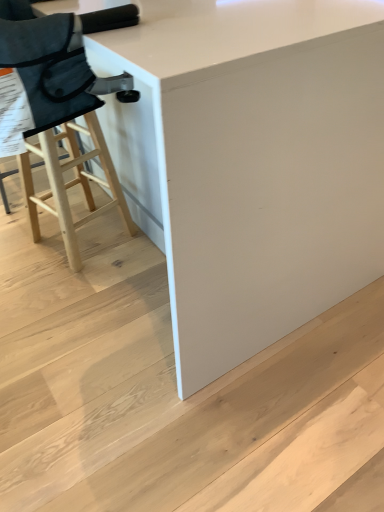
Question: Does white glossy table at center come in front of white matte stair at lower center?

Choices:
 (A) yes
 (B) no

Answer: (A)

Question: Is the depth of white glossy table at center greater than that of white matte stair at lower center?

Choices:
 (A) no
 (B) yes

Answer: (A)

Question: Can you confirm if white glossy table at center is taller than white matte stair at lower center?

Choices:
 (A) no
 (B) yes

Answer: (B)

Question: Is white glossy table at center far from white matte stair at lower center?

Choices:
 (A) yes
 (B) no

Answer: (B)

Question: Is white glossy table at center positioned with its back to white matte stair at lower center?

Choices:
 (A) no
 (B) yes

Answer: (A)

Question: Is point (97, 480) closer or farther from the camera than point (64, 50)?

Choices:
 (A) closer
 (B) farther

Answer: (B)

Question: Considering the positions of white matte stair at lower center and natural wood stool at left in the image, is white matte stair at lower center bigger or smaller than natural wood stool at left?

Choices:
 (A) big
 (B) small

Answer: (A)

Question: Considering the positions of white matte stair at lower center and natural wood stool at left in the image, is white matte stair at lower center wider or thinner than natural wood stool at left?

Choices:
 (A) wide
 (B) thin

Answer: (A)

Question: Which is correct: white matte stair at lower center is inside natural wood stool at left, or outside of it?

Choices:
 (A) inside
 (B) outside

Answer: (B)

Question: Based on their sizes in the image, would you say white glossy table at center is bigger or smaller than natural wood stool at left?

Choices:
 (A) small
 (B) big

Answer: (B)

Question: Is white glossy table at center spatially inside natural wood stool at left, or outside of it?

Choices:
 (A) outside
 (B) inside

Answer: (A)

Question: In the image, is white glossy table at center positioned in front of or behind natural wood stool at left?

Choices:
 (A) front
 (B) behind

Answer: (A)

Question: Visually, is white glossy table at center positioned to the left or to the right of natural wood stool at left?

Choices:
 (A) left
 (B) right

Answer: (B)

Question: From a real-world perspective, is white matte stair at lower center above or below white glossy table at center?

Choices:
 (A) below
 (B) above

Answer: (A)

Question: Do you think white matte stair at lower center is within white glossy table at center, or outside of it?

Choices:
 (A) inside
 (B) outside

Answer: (A)